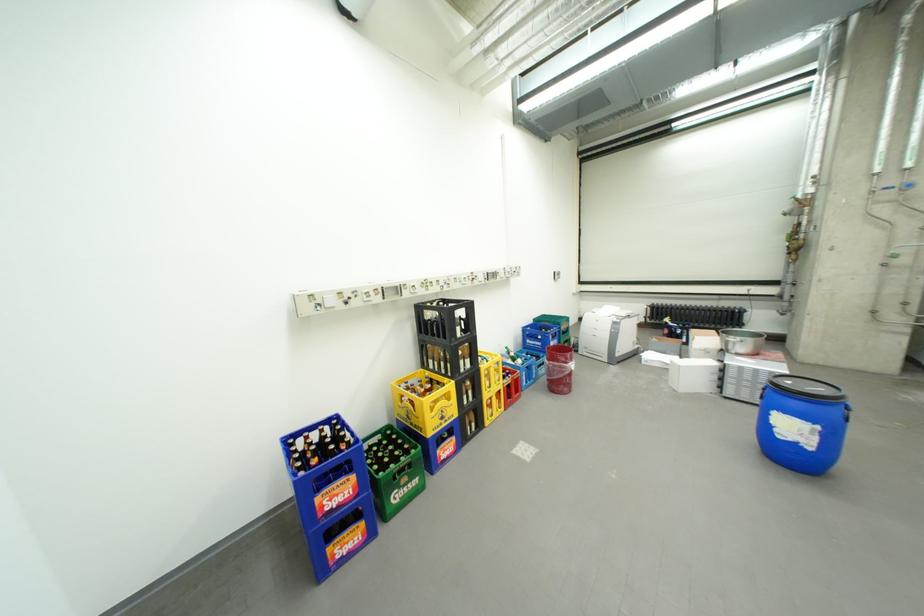
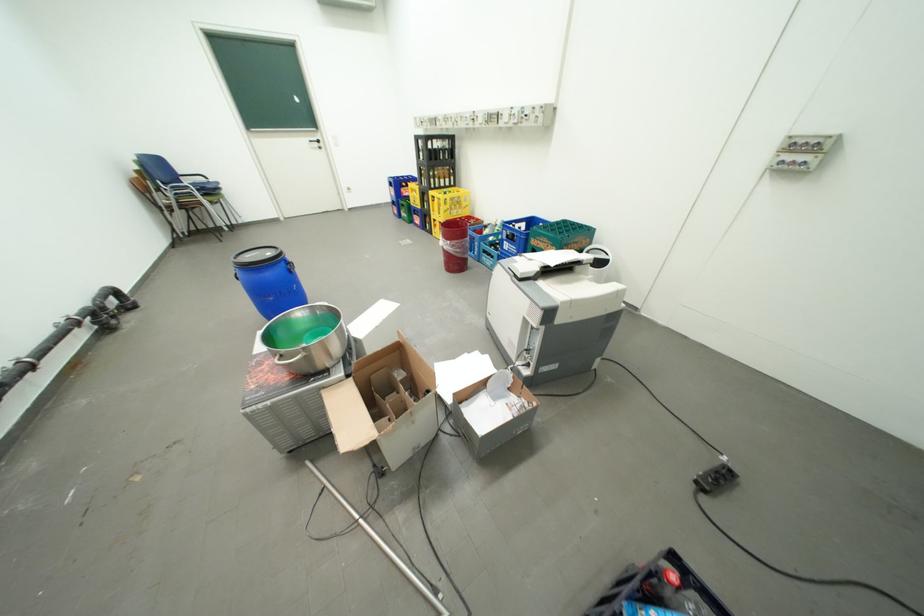
In the second image, find the point that corresponds to the point at 562,344 in the first image.

(516, 244)